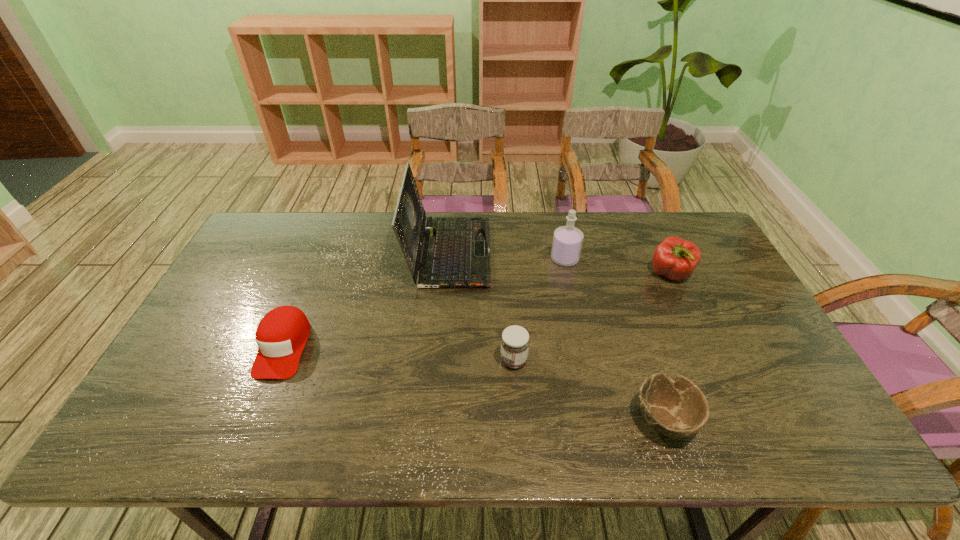
The image size is (960, 540). What are the coordinates of `blank space located 0.380m on the screen of the tallest object` in the screenshot? It's located at (604, 253).

Identify the location of vacant area situated on the right of the fifth shortest object. The image size is (960, 540). (615, 259).

The image size is (960, 540). Find the location of `free point located on the front of the bell pepper`. free point located on the front of the bell pepper is located at coordinates (697, 332).

Where is `blank area located on the front label of the fourth object from right to left`? The width and height of the screenshot is (960, 540). blank area located on the front label of the fourth object from right to left is located at coordinates (416, 360).

Identify the location of vacant position located on the front label of the fourth object from right to left. (396, 360).

Where is `free location located 0.300m on the front label of the fourth object from right to left`? This screenshot has height=540, width=960. free location located 0.300m on the front label of the fourth object from right to left is located at coordinates (385, 360).

Identify the location of vacant area situated 0.120m on the front-facing side of the leftmost object. Image resolution: width=960 pixels, height=540 pixels. (252, 426).

I want to click on vacant point located 0.260m on the right of the nearest object, so click(807, 419).

Identify the location of laptop computer present at the far edge. The image size is (960, 540). (456, 252).

Identify the location of perfume located at the far edge. The image size is (960, 540). (567, 241).